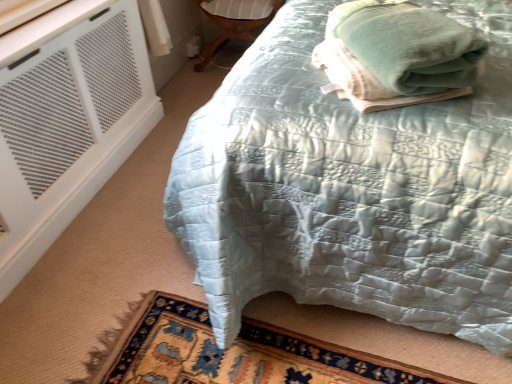
Question: From their relative heights in the image, would you say white mesh air conditioning at lower left is taller or shorter than carpeted rug at lower left?

Choices:
 (A) short
 (B) tall

Answer: (B)

Question: From a real-world perspective, is white mesh air conditioning at lower left above or below carpeted rug at lower left?

Choices:
 (A) below
 (B) above

Answer: (B)

Question: Estimate the real-world distances between objects in this image. Which object is farther from the silky blue quilt at center?

Choices:
 (A) matte wood side table at lower center
 (B) green soft towel at upper right
 (C) white mesh air conditioning at lower left
 (D) carpeted rug at lower left

Answer: (A)

Question: Estimate the real-world distances between objects in this image. Which object is farther from the matte wood side table at lower center?

Choices:
 (A) silky blue quilt at center
 (B) carpeted rug at lower left
 (C) green soft towel at upper right
 (D) white mesh air conditioning at lower left

Answer: (B)